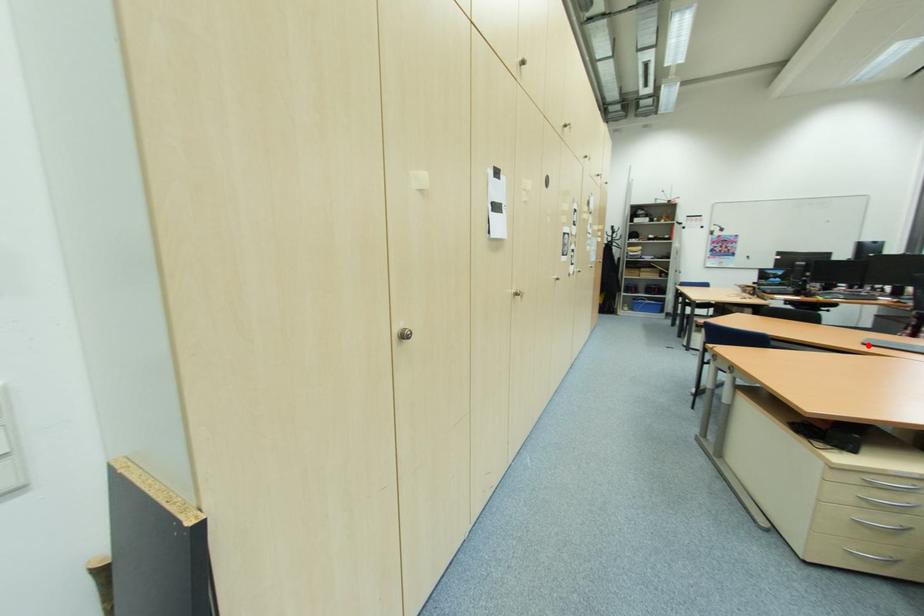
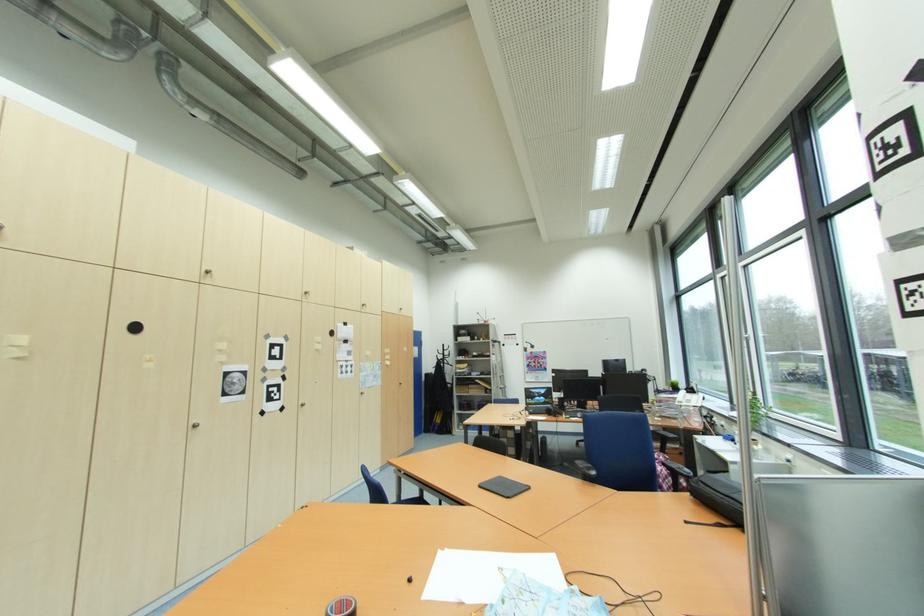
Locate, in the second image, the point that corresponds to the highlighted location in the first image.

(484, 487)